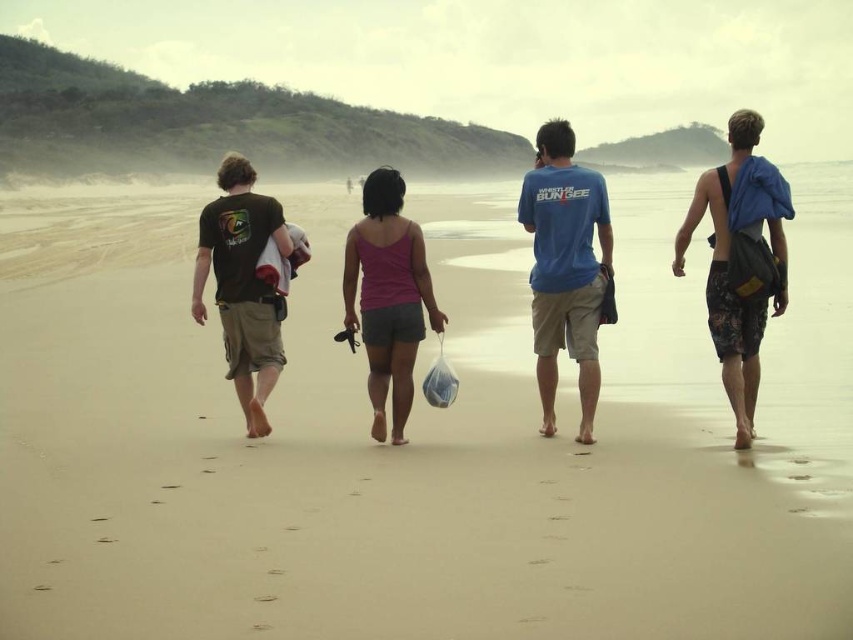
Question: Where is sandy beach at center located in relation to blue camouflage shorts at right in the image?

Choices:
 (A) left
 (B) right

Answer: (A)

Question: In this image, where is sandy beach at center located relative to matte black t-shirt at left?

Choices:
 (A) above
 (B) below

Answer: (A)

Question: Which point is farther from the camera taking this photo?

Choices:
 (A) tap(550, 420)
 (B) tap(260, 310)
 (C) tap(347, 273)

Answer: (B)

Question: Based on their relative distances, which object is nearer to the blue cotton t-shirt at center?

Choices:
 (A) pink fabric tank top at center
 (B) sandy beach at center
 (C) matte black t-shirt at left
 (D) blue camouflage shorts at right

Answer: (A)

Question: Which object is positioned farthest from the blue cotton t-shirt at center?

Choices:
 (A) blue camouflage shorts at right
 (B) pink fabric tank top at center

Answer: (A)

Question: Is sandy beach at center behind blue cotton t-shirt at center?

Choices:
 (A) yes
 (B) no

Answer: (B)